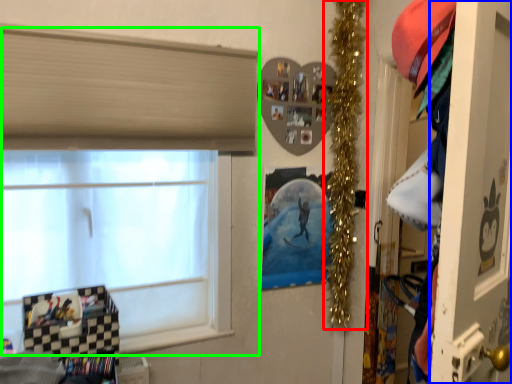
Question: Estimate the real-world distances between objects in this image. Which object is farther from christmas decoration (highlighted by a red box), screen door (highlighted by a blue box) or window (highlighted by a green box)?

Choices:
 (A) screen door
 (B) window

Answer: (A)